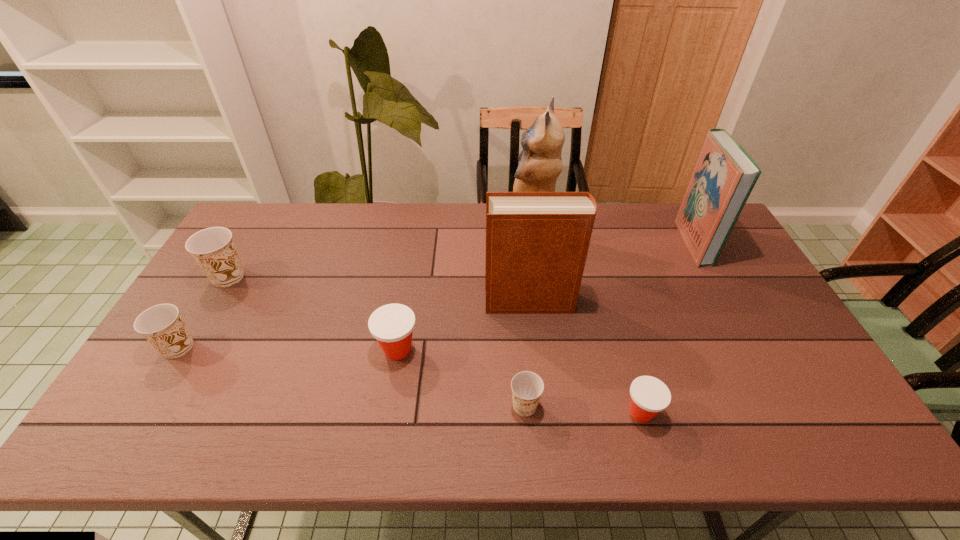
What are the coordinates of `the tallest object` in the screenshot? It's located at (540, 165).

What are the coordinates of `the right hardback book` in the screenshot? It's located at (725, 174).

This screenshot has height=540, width=960. What are the coordinates of `the rightmost object` in the screenshot? It's located at (725, 174).

Find the location of a particular element. This screenshot has height=540, width=960. the nearer hardback book is located at coordinates (537, 243).

Find the location of `the farthest Dixie cup`. the farthest Dixie cup is located at coordinates (213, 248).

Locate an element on the screen. This screenshot has width=960, height=540. the fourth tallest object is located at coordinates (213, 248).

You are a GUI agent. You are given a task and a screenshot of the screen. Output one action in this format:
    pyautogui.click(x=<x>, y=<y>)
    Task: Click on the bigger red-orange Dixie cup
    This screenshot has height=540, width=960.
    Given the screenshot: What is the action you would take?
    pyautogui.click(x=392, y=325)

The height and width of the screenshot is (540, 960). I want to click on the farther red-orange Dixie cup, so click(x=392, y=325).

Image resolution: width=960 pixels, height=540 pixels. I want to click on the second farthest orange Dixie cup, so click(161, 325).

Where is `the fourth Dixie cup from left to right`? The image size is (960, 540). the fourth Dixie cup from left to right is located at coordinates (527, 387).